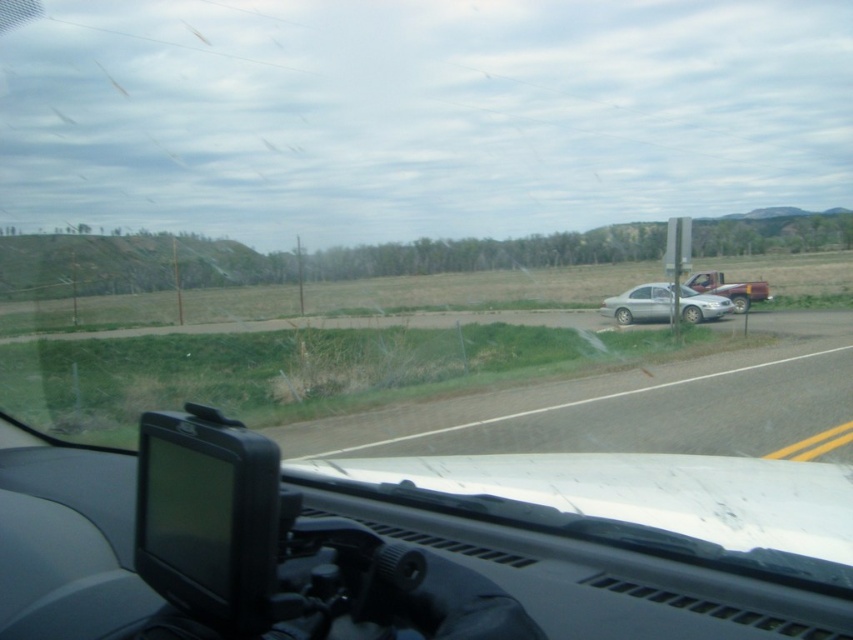
From the picture: You are driving a car and see the satin silver sedan at right parked on the side of the road. If your car is 15 feet long, can you safely pass it without crossing the white edge line on the right?

The satin silver sedan at right is 71.22 feet from the camera. Since your car is only 15 feet long, there is enough space between your car and the sedan to safely pass without crossing the white edge line. However, you should check local traffic laws and ensure the road curvature allows safe passing.

You are driving a car and need to park behind the satin silver sedan at right and the matte red truck at right. Which vehicle will require more space to park behind due to its width?

The matte red truck at right requires more space to park behind because its width is greater than the satin silver sedan at right.

You are driving a car and see the satin silver sedan at right and the matte red truck at right parked on the side of the road. Which vehicle is closer to your current position?

The satin silver sedan at right is closer to your current position because it is in front of the matte red truck at right.